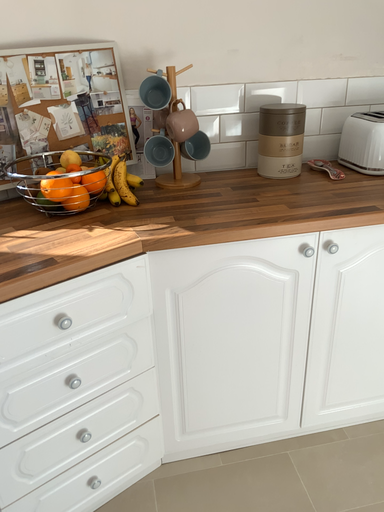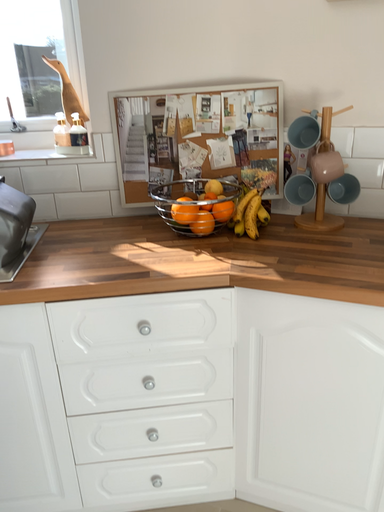
Question: Which way did the camera rotate in the video?

Choices:
 (A) rotated upward
 (B) rotated downward

Answer: (A)